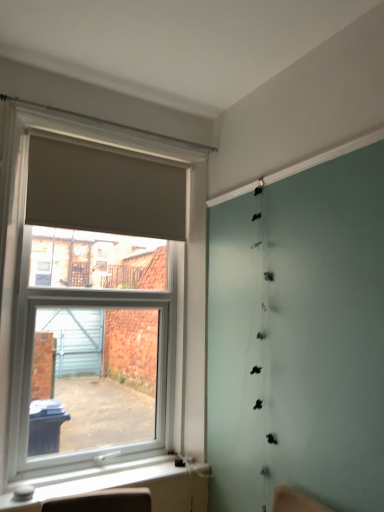
Question: Does matte beige curtain at upper left appear on the left side of matte gray roller blind at left?

Choices:
 (A) no
 (B) yes

Answer: (A)

Question: Is matte beige curtain at upper left with matte gray roller blind at left?

Choices:
 (A) no
 (B) yes

Answer: (A)

Question: Considering the relative sizes of matte beige curtain at upper left and matte gray roller blind at left in the image provided, is matte beige curtain at upper left smaller than matte gray roller blind at left?

Choices:
 (A) yes
 (B) no

Answer: (A)

Question: Is matte beige curtain at upper left surrounding matte gray roller blind at left?

Choices:
 (A) no
 (B) yes

Answer: (A)

Question: From the image's perspective, does matte beige curtain at upper left appear lower than matte gray roller blind at left?

Choices:
 (A) no
 (B) yes

Answer: (A)

Question: Does matte beige curtain at upper left have a lesser width compared to matte gray roller blind at left?

Choices:
 (A) yes
 (B) no

Answer: (A)

Question: Considering the relative sizes of matte gray roller blind at left and matte beige curtain at upper left in the image provided, is matte gray roller blind at left bigger than matte beige curtain at upper left?

Choices:
 (A) yes
 (B) no

Answer: (A)

Question: Would you say matte gray roller blind at left is outside matte beige curtain at upper left?

Choices:
 (A) yes
 (B) no

Answer: (A)

Question: Can you confirm if matte gray roller blind at left is positioned to the right of matte beige curtain at upper left?

Choices:
 (A) no
 (B) yes

Answer: (A)

Question: Is matte gray roller blind at left oriented towards matte beige curtain at upper left?

Choices:
 (A) yes
 (B) no

Answer: (A)

Question: Is matte gray roller blind at left placed right next to matte beige curtain at upper left?

Choices:
 (A) no
 (B) yes

Answer: (A)

Question: Is matte gray roller blind at left thinner than matte beige curtain at upper left?

Choices:
 (A) no
 (B) yes

Answer: (A)

Question: Is white plastic window sill at lower left aimed at matte beige curtain at upper left?

Choices:
 (A) yes
 (B) no

Answer: (B)